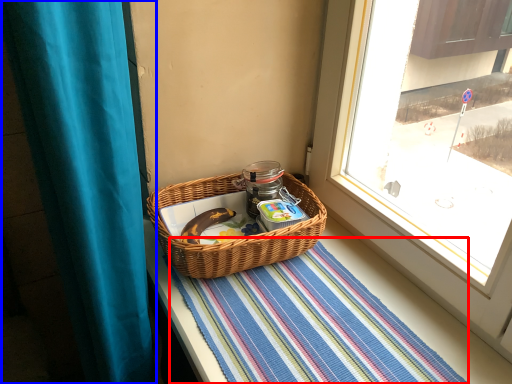
Question: Among these objects, which one is farthest to the camera, mat (highlighted by a red box) or curtain (highlighted by a blue box)?

Choices:
 (A) mat
 (B) curtain

Answer: (A)